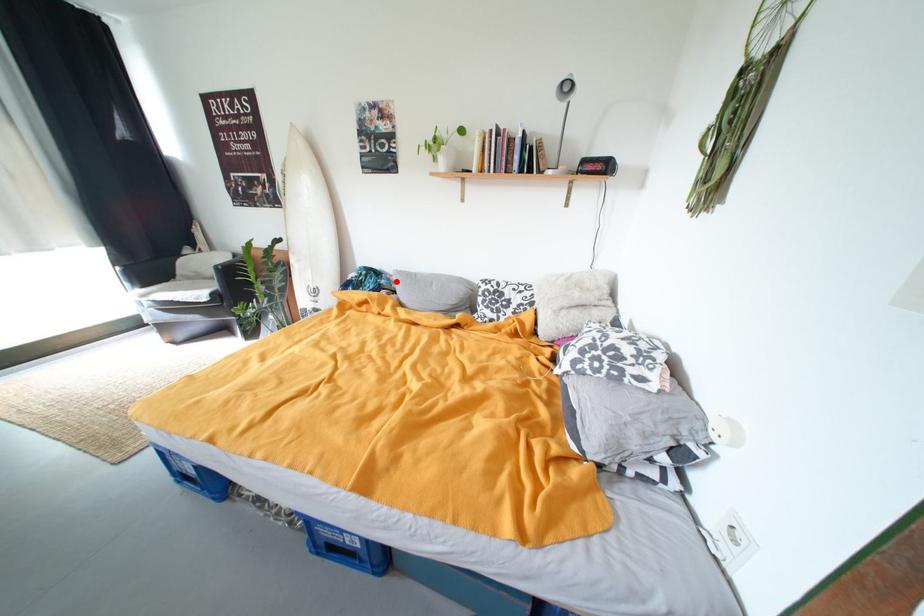
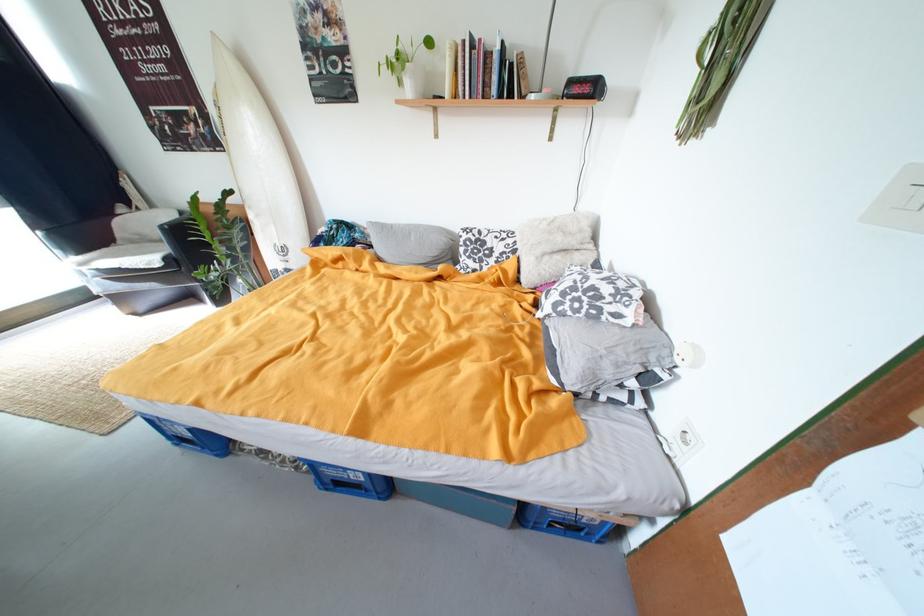
In the second image, find the point that corresponds to the highlighted location in the first image.

(371, 235)